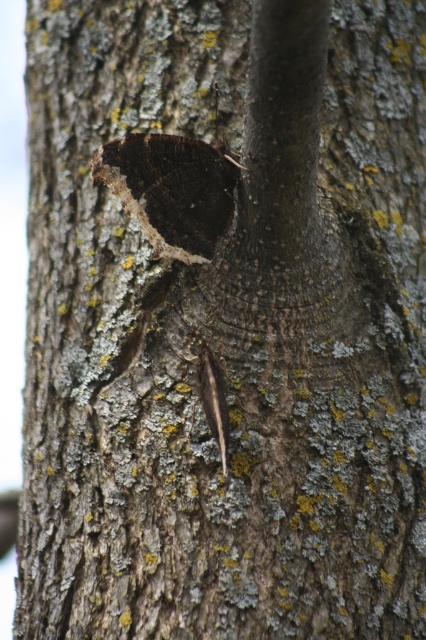
You are a nature photographer trying to capture both the dark matte butterfly at center and the brown fuzzy caterpillar at center in a single close shot. Given that your camera can focus on objects within a 10 centimeter range, will you be able to include both subjects in the frame without moving the camera?

The dark matte butterfly at center and the brown fuzzy caterpillar at center are 11.87 centimeters apart, which exceeds the camera focus range of 10 centimeters. Therefore, you cannot include both subjects in the frame without moving the camera.

You are an entomologist observing the tree trunk. You see the dark matte butterfly at center and the brown fuzzy caterpillar at center. Which one has a larger width?

The dark matte butterfly at center might be wider than brown fuzzy caterpillar at center.

You are an entomologist observing a tree trunk. You see a dark matte butterfly at center and a brown fuzzy caterpillar at center. Which one is positioned more to the left?

The dark matte butterfly at center is positioned to the left of the brown fuzzy caterpillar at center.